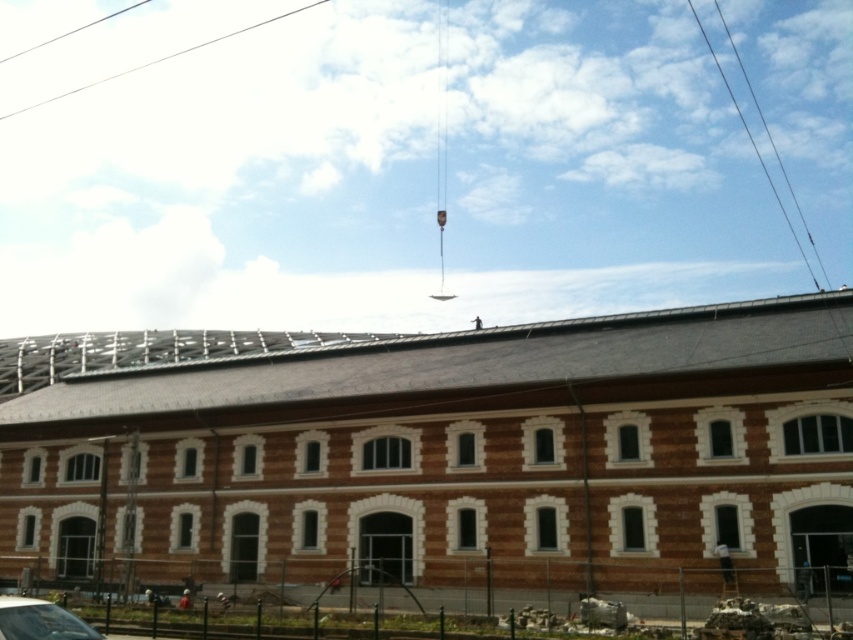
Question: Does clear glass car at lower left have a greater width compared to metallic wire at upper center?

Choices:
 (A) yes
 (B) no

Answer: (B)

Question: Where is clear glass car at lower left located in relation to metallic wire at upper center in the image?

Choices:
 (A) above
 (B) below

Answer: (B)

Question: Among these objects, which one is nearest to the camera?

Choices:
 (A) metallic wire at upper center
 (B) clear glass car at lower left

Answer: (B)

Question: Which point is closer to the camera?

Choices:
 (A) (4, 628)
 (B) (241, 28)

Answer: (A)

Question: Is clear glass car at lower left wider than metallic wire at upper center?

Choices:
 (A) yes
 (B) no

Answer: (B)